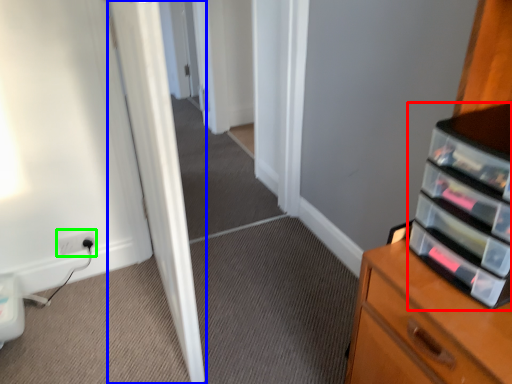
Question: Estimate the real-world distances between objects in this image. Which object is closer to shelf (highlighted by a red box), door (highlighted by a blue box) or electric outlet (highlighted by a green box)?

Choices:
 (A) door
 (B) electric outlet

Answer: (A)